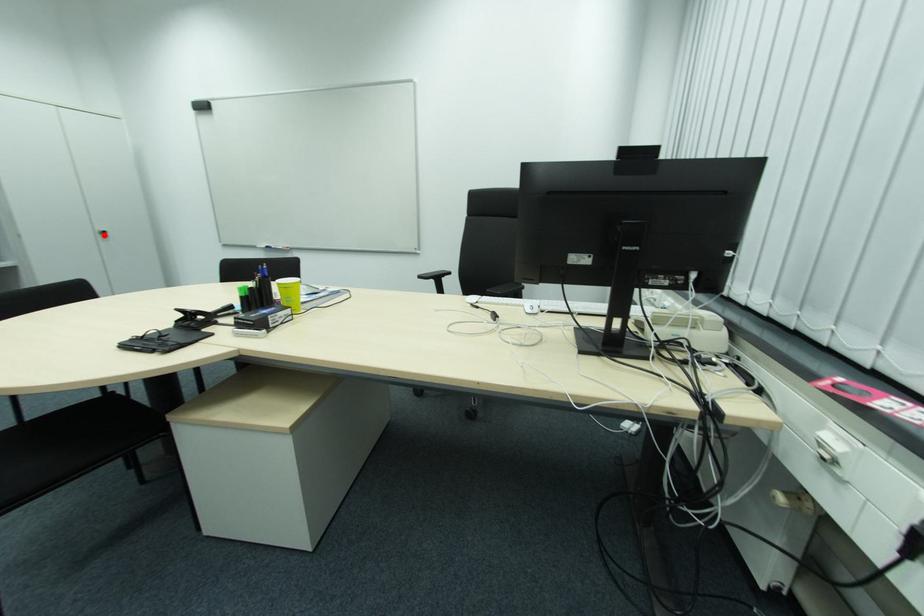
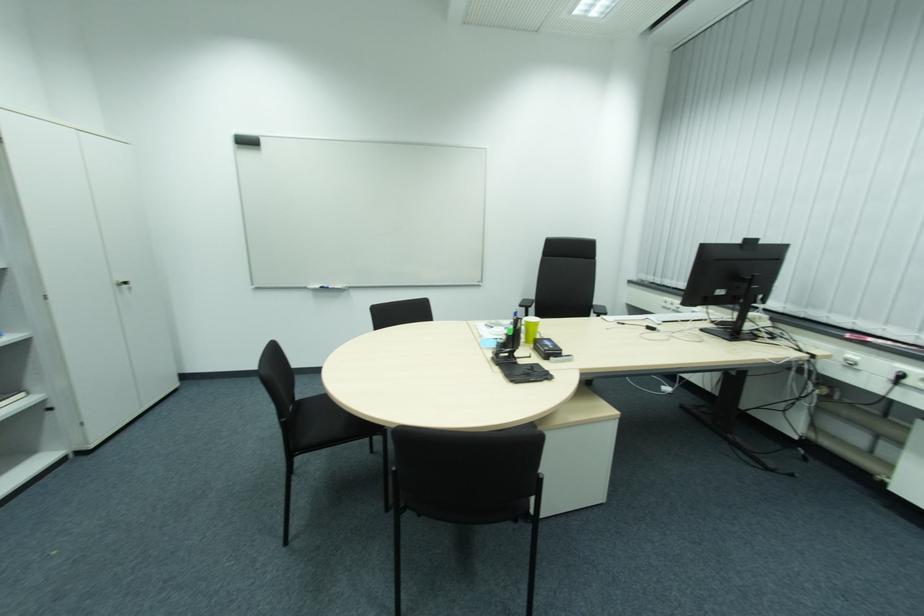
Where in the second image is the point corresponding to the highlighted location from the first image?

(122, 286)